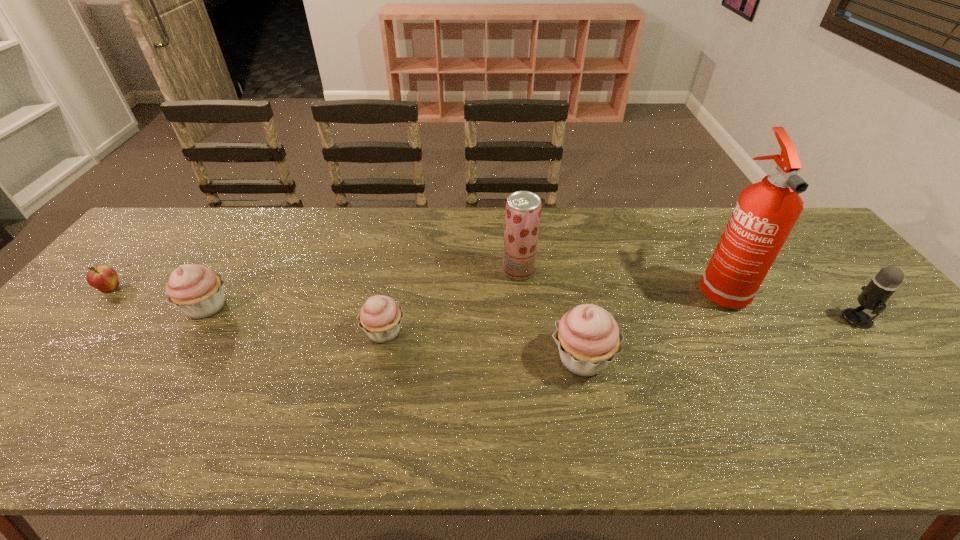
Identify the location of the leftmost cupcake. (197, 290).

Find the location of `the second object from left to right`. the second object from left to right is located at coordinates point(197,290).

Locate an element on the screen. The image size is (960, 540). the second cupcake from right to left is located at coordinates (381, 316).

Identify the location of the fifth object from right to left. The image size is (960, 540). (381, 316).

Locate an element on the screen. Image resolution: width=960 pixels, height=540 pixels. the fifth object from left to right is located at coordinates (588, 338).

Where is `the fourth object from left to right`? The width and height of the screenshot is (960, 540). the fourth object from left to right is located at coordinates (523, 208).

You are a GUI agent. You are given a task and a screenshot of the screen. Output one action in this format:
    pyautogui.click(x=<x>, y=<y>)
    Task: Click on the second tallest object
    Image resolution: width=960 pixels, height=540 pixels.
    Given the screenshot: What is the action you would take?
    pyautogui.click(x=523, y=208)

Image resolution: width=960 pixels, height=540 pixels. Identify the location of microphone. (873, 297).

Locate an element on the screen. The image size is (960, 540). the tallest object is located at coordinates (766, 212).

Locate an element on the screen. the second object from right to left is located at coordinates (766, 212).